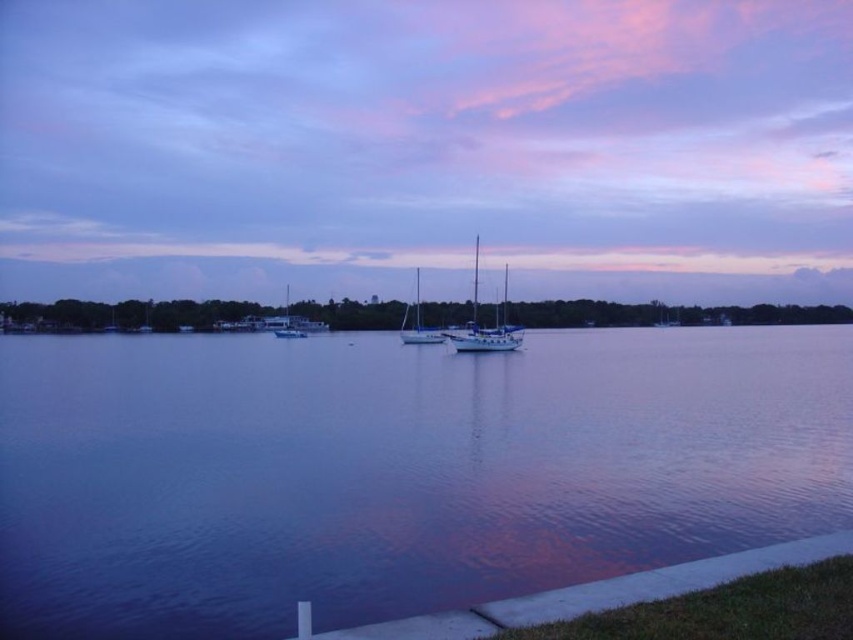
Question: Which point appears farthest from the camera in this image?

Choices:
 (A) (422, 340)
 (B) (242, 83)

Answer: (B)

Question: Which object appears farthest from the camera in this image?

Choices:
 (A) smooth water at center
 (B) purple sky at upper center

Answer: (B)

Question: Does purple sky at upper center appear under smooth water at center?

Choices:
 (A) no
 (B) yes

Answer: (A)

Question: Does smooth water at center have a smaller size compared to white matte sailboat at center?

Choices:
 (A) yes
 (B) no

Answer: (A)

Question: Does white glossy sailboat at center appear on the left side of white matte sailboat at center?

Choices:
 (A) yes
 (B) no

Answer: (B)

Question: Which object appears closest to the camera in this image?

Choices:
 (A) white glossy sailboat at center
 (B) white matte boat at center

Answer: (A)